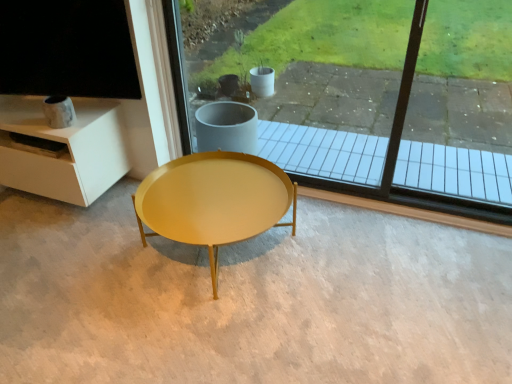
The width and height of the screenshot is (512, 384). In order to click on unoccupied area in front of matte yellow table at center in this screenshot , I will do `click(211, 336)`.